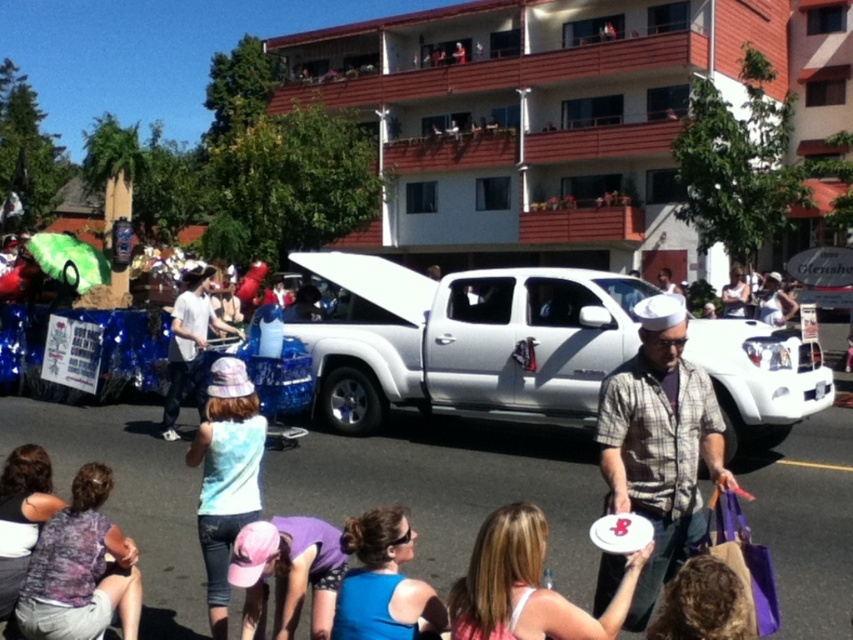
Question: Which object is the farthest from the white cotton shirt at center?

Choices:
 (A) white matte frisbee at center
 (B) white metallic pickup truck at center
 (C) blue fabric shirt at center

Answer: (A)

Question: In this image, where is white matte frisbee at center located relative to blue fabric shirt at center?

Choices:
 (A) right
 (B) left

Answer: (A)

Question: Which point is farther to the camera?

Choices:
 (A) white metallic pickup truck at center
 (B) blue fabric shirt at center

Answer: (A)

Question: Is white matte frisbee at center closer to the viewer compared to white cotton shirt at center?

Choices:
 (A) no
 (B) yes

Answer: (B)

Question: Estimate the real-world distances between objects in this image. Which object is farther from the white matte frisbee at center?

Choices:
 (A) light purple tie-dye shirt at lower left
 (B) light blue tie-dye tank top at center
 (C) white metallic pickup truck at center
 (D) purple fabric cap at lower center

Answer: (C)

Question: Can you confirm if light blue tie-dye tank top at center is positioned to the right of white cotton shirt at center?

Choices:
 (A) no
 (B) yes

Answer: (B)